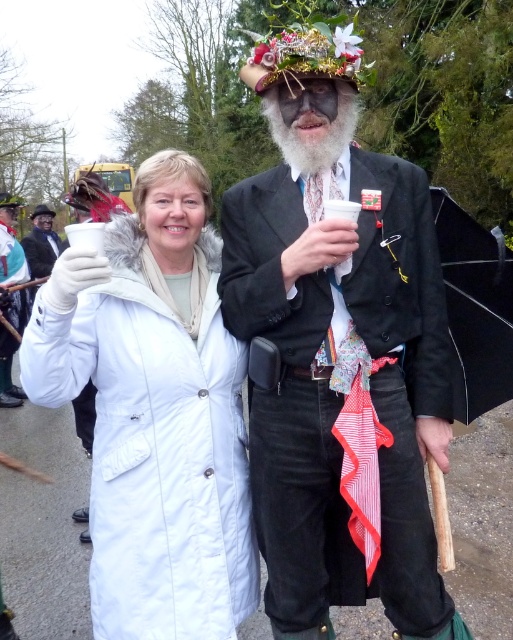
Question: Which of the following is the farthest from the observer?

Choices:
 (A) shiny black coat at center
 (B) white matte coat at center
 (C) matte black hat at upper left

Answer: (C)

Question: Which point is closer to the camera taking this photo?

Choices:
 (A) (192, 305)
 (B) (340, 227)
 (C) (345, 132)
 (D) (40, 241)

Answer: (B)

Question: Is black matte beard at center smaller than white matte coat at center?

Choices:
 (A) no
 (B) yes

Answer: (B)

Question: Is white fur-trimmed coat at center wider than white matte coat at center?

Choices:
 (A) no
 (B) yes

Answer: (A)

Question: Can you confirm if white fur-trimmed coat at center is wider than white matte coat at center?

Choices:
 (A) yes
 (B) no

Answer: (B)

Question: Which of the following is the closest to the observer?

Choices:
 (A) (422, 419)
 (B) (107, 364)

Answer: (B)